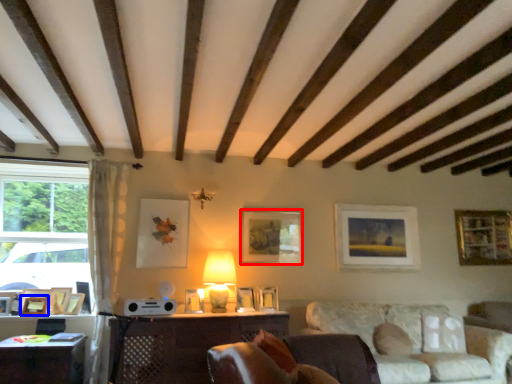
Question: Which object appears closest to the camera in this image, picture frame (highlighted by a red box) or picture frame (highlighted by a blue box)?

Choices:
 (A) picture frame
 (B) picture frame

Answer: (B)